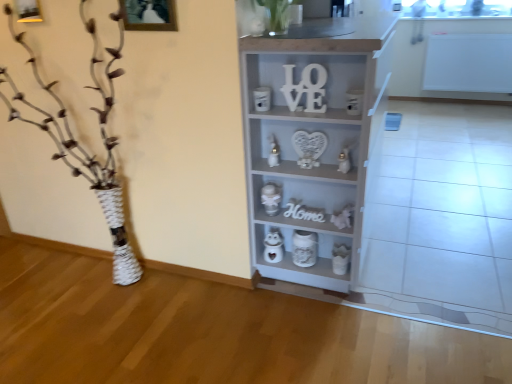
Question: Does green matte plant at upper center contain metallic silver toy at center, the third toy viewed from the top?

Choices:
 (A) yes
 (B) no

Answer: (B)

Question: Could you tell me if green matte plant at upper center is turned towards metallic silver toy at center, placed as the fourth toy when sorted from bottom to top?

Choices:
 (A) no
 (B) yes

Answer: (A)

Question: Does green matte plant at upper center come behind metallic silver toy at center, placed as the fourth toy when sorted from bottom to top?

Choices:
 (A) yes
 (B) no

Answer: (B)

Question: From a real-world perspective, is green matte plant at upper center located higher than metallic silver toy at center, placed as the fourth toy when sorted from bottom to top?

Choices:
 (A) no
 (B) yes

Answer: (B)

Question: Is green matte plant at upper center touching metallic silver toy at center, placed as the fourth toy when sorted from bottom to top?

Choices:
 (A) no
 (B) yes

Answer: (A)

Question: Is point (78, 170) closer or farther from the camera than point (269, 158)?

Choices:
 (A) closer
 (B) farther

Answer: (B)

Question: Visually, is white textured vase at left positioned to the left or to the right of white glossy candle at center, which is the sixth toy from bottom to top?

Choices:
 (A) left
 (B) right

Answer: (A)

Question: Considering the positions of white textured vase at left and white glossy candle at center, which is the sixth toy from bottom to top, in the image, is white textured vase at left wider or thinner than white glossy candle at center, which is the sixth toy from bottom to top,?

Choices:
 (A) wide
 (B) thin

Answer: (A)

Question: Looking at the image, does white textured vase at left seem bigger or smaller compared to white glossy candle at center, arranged as the 1th toy when viewed from the top?

Choices:
 (A) small
 (B) big

Answer: (B)

Question: From a real-world perspective, is white wooden letter at upper center, the 2th letter positioned from the back, positioned above or below white glossy figurine at center, marked as the 5th toy in a bottom-to-top arrangement?

Choices:
 (A) above
 (B) below

Answer: (A)

Question: Would you say white wooden letter at upper center, which appears as the second letter when ordered from the bottom, is to the left or to the right of white glossy figurine at center, marked as the 5th toy in a bottom-to-top arrangement, in the picture?

Choices:
 (A) left
 (B) right

Answer: (A)

Question: Considering their positions, is white wooden letter at upper center, the 2th letter positioned from the back, located in front of or behind white glossy figurine at center, marked as the 2th toy in a top-to-bottom arrangement?

Choices:
 (A) behind
 (B) front

Answer: (B)

Question: From their relative heights in the image, would you say white wooden letter at upper center, the 2th letter positioned from the back, is taller or shorter than white glossy figurine at center, marked as the 2th toy in a top-to-bottom arrangement?

Choices:
 (A) tall
 (B) short

Answer: (A)

Question: Based on their positions, is metallic silver toy at center, placed as the fourth toy when sorted from bottom to top, located to the left or right of white wooden letter at upper center, the 2th letter positioned from the back?

Choices:
 (A) right
 (B) left

Answer: (B)

Question: Is point (271, 210) closer or farther from the camera than point (316, 99)?

Choices:
 (A) closer
 (B) farther

Answer: (B)